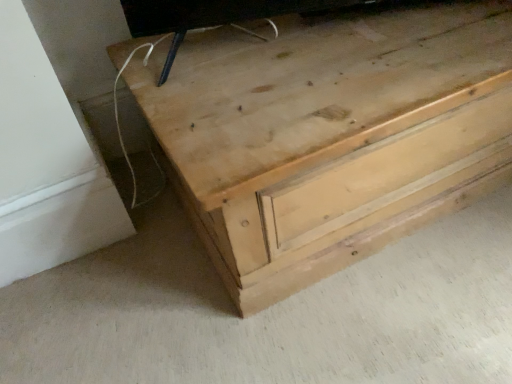
What do you see at coordinates (330, 135) in the screenshot? This screenshot has width=512, height=384. I see `natural wood chest of drawers at lower center` at bounding box center [330, 135].

Where is `natural wood chest of drawers at lower center`? Image resolution: width=512 pixels, height=384 pixels. natural wood chest of drawers at lower center is located at coordinates (330, 135).

This screenshot has height=384, width=512. Find the location of `natural wood chest of drawers at lower center`. natural wood chest of drawers at lower center is located at coordinates (330, 135).